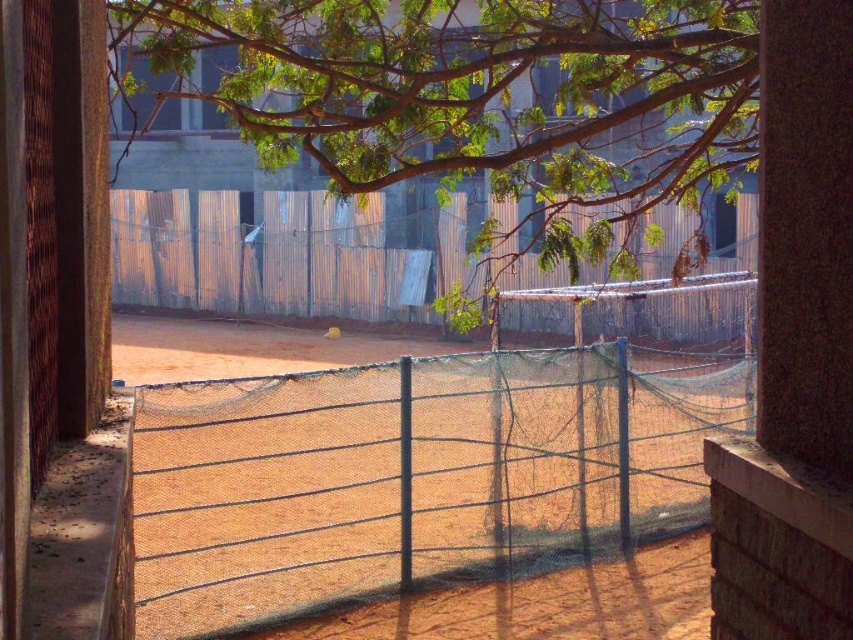
Question: Which point is farther to the camera?

Choices:
 (A) green mesh tennis net at center
 (B) rusty corrugated metal fence at center
 (C) green leafy tree at upper center

Answer: (B)

Question: Estimate the real-world distances between objects in this image. Which object is closer to the green leafy tree at upper center?

Choices:
 (A) rusty corrugated metal fence at center
 (B) green mesh tennis net at center

Answer: (A)

Question: Is green mesh tennis net at center above green leafy tree at upper center?

Choices:
 (A) yes
 (B) no

Answer: (B)

Question: Can you confirm if green leafy tree at upper center is positioned below rusty corrugated metal fence at center?

Choices:
 (A) no
 (B) yes

Answer: (A)

Question: Does green mesh tennis net at center lie in front of rusty corrugated metal fence at center?

Choices:
 (A) yes
 (B) no

Answer: (A)

Question: Which of the following is the closest to the observer?

Choices:
 (A) green mesh tennis net at center
 (B) rusty corrugated metal fence at center

Answer: (A)